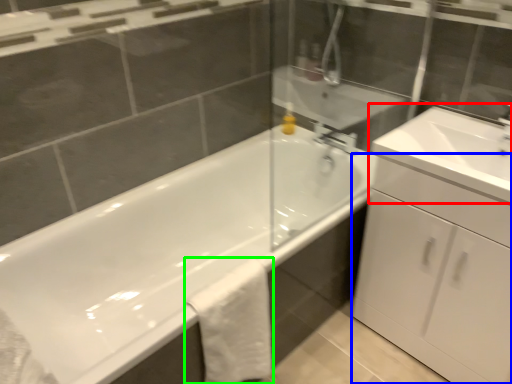
Question: Which is nearer to the sink (highlighted by a red box)? cabinetry (highlighted by a blue box) or bath towel (highlighted by a green box).

Choices:
 (A) cabinetry
 (B) bath towel

Answer: (A)